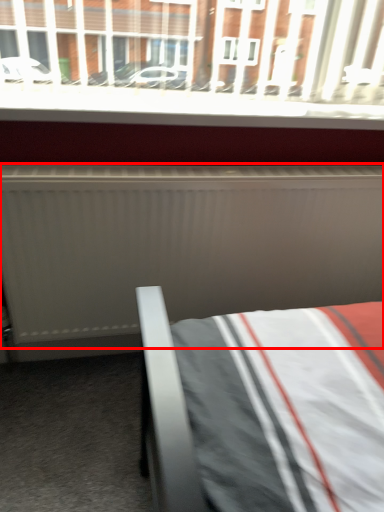
Question: From the image's perspective, considering the relative positions of radiator (annotated by the red box) and window sill in the image provided, where is radiator (annotated by the red box) located with respect to the staircase?

Choices:
 (A) above
 (B) below

Answer: (B)